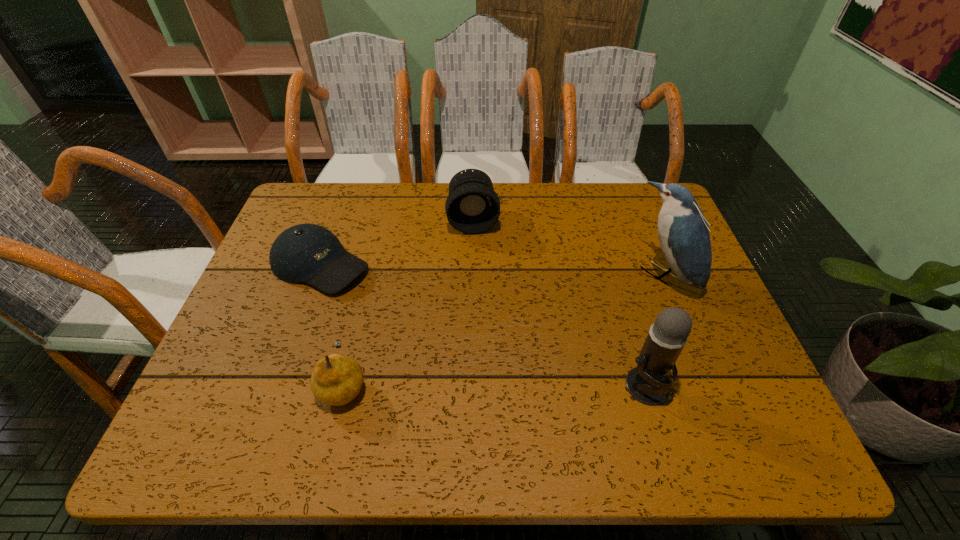
Where is `vacant space located 0.330m on the front-facing side of the baseball cap`? This screenshot has height=540, width=960. vacant space located 0.330m on the front-facing side of the baseball cap is located at coordinates (467, 342).

You are a GUI agent. You are given a task and a screenshot of the screen. Output one action in this format:
    pyautogui.click(x=<x>, y=<y>)
    Task: Click on the vacant area situated 0.070m on the front-facing side of the baseball cap
    This screenshot has height=540, width=960.
    Given the screenshot: What is the action you would take?
    pyautogui.click(x=379, y=294)

Where is `free space located 0.120m on the front-facing side of the baseball cap`? free space located 0.120m on the front-facing side of the baseball cap is located at coordinates pos(395,303).

You are a GUI agent. You are given a task and a screenshot of the screen. Output one action in this format:
    pyautogui.click(x=<x>, y=<y>)
    Task: Click on the vacant space situated 0.080m at the front element of the telephoto lens
    Image resolution: width=960 pixels, height=540 pixels.
    Given the screenshot: What is the action you would take?
    pyautogui.click(x=477, y=256)

At what (x,y) coordinates should I click in order to perform the action: click on vacant space located at the front element of the telephoto lens. Please return your answer as a coordinate pair (x, y). This screenshot has width=960, height=540. Looking at the image, I should click on (486, 346).

Where is `vacant area situated 0.380m at the front element of the telephoto lens`? This screenshot has width=960, height=540. vacant area situated 0.380m at the front element of the telephoto lens is located at coordinates (486, 349).

Locate an element on the screen. The height and width of the screenshot is (540, 960). object that is at the far edge is located at coordinates (472, 206).

Identify the location of pear that is at the near edge. (337, 379).

At what (x,y) coordinates should I click in order to perform the action: click on microphone that is at the near edge. Please return your answer as a coordinate pair (x, y). This screenshot has width=960, height=540. Looking at the image, I should click on (647, 383).

At what (x,y) coordinates should I click in order to perform the action: click on object at the left edge. Please return your answer as a coordinate pair (x, y). The height and width of the screenshot is (540, 960). Looking at the image, I should click on (305, 253).